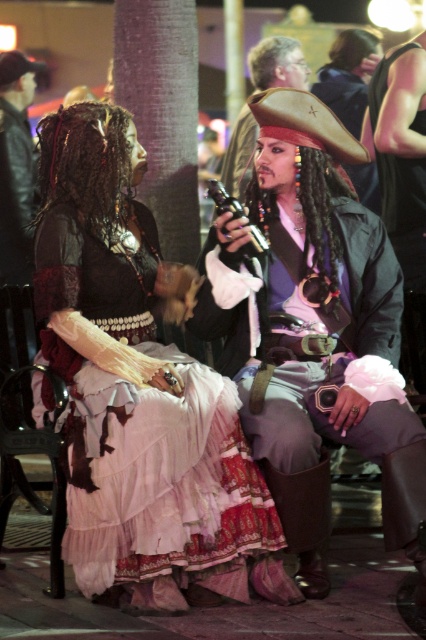
You are a costume designer who needs to adjust the positioning of the leather pirate hat at center and the shiny black vest at right for a more balanced look. Based on their current positions, which object is located lower on the person?

The leather pirate hat at center is located lower than the shiny black vest at right because it is positioned below it.

You are a photographer at the event and want to take a photo of both the ruffled lace dress at center and the shiny black vest at right. However, you need to ensure that neither of them is blocking the other in the shot. Based on their positions, can you position yourself in a way that both are fully visible without any obstruction?

The ruffled lace dress at center is in front of the shiny black vest at right, so positioning yourself to the side of the ruffled lace dress at center would allow you to see both without obstruction.

You are a photographer at the event and need to capture a photo of both the ruffled lace dress at center and the shiny black vest at right. The minimum distance required for your camera to focus on both subjects clearly is 2 meters. Can you position yourself so that both items are within the camera range?

The ruffled lace dress at center and the shiny black vest at right are 2.09 meters apart. Since the camera requires a minimum of 2 meters, the distance is sufficient, so yes, you can position yourself to capture both within focus.